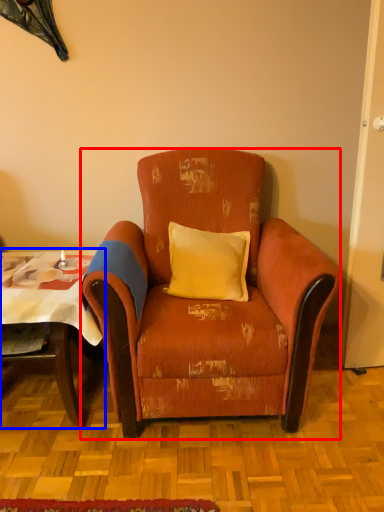
Question: Which point is closer to the camera, chair (highlighted by a red box) or table (highlighted by a blue box)?

Choices:
 (A) chair
 (B) table

Answer: (A)